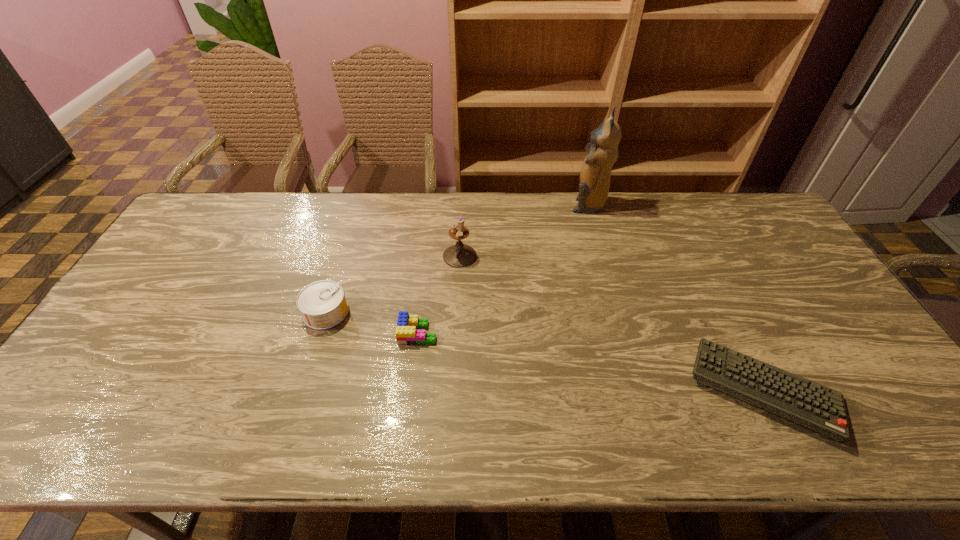
Locate an element on the screen. The image size is (960, 540). free space at the left edge of the desktop is located at coordinates (167, 272).

This screenshot has width=960, height=540. Find the location of `free region at the right edge of the desktop`. free region at the right edge of the desktop is located at coordinates (817, 318).

The height and width of the screenshot is (540, 960). In the image, there is a desktop. In order to click on vacant space at the far left corner in this screenshot , I will do 184,235.

Where is `empty space between the second tallest object and the Lego`? Image resolution: width=960 pixels, height=540 pixels. empty space between the second tallest object and the Lego is located at coordinates (439, 294).

You are a GUI agent. You are given a task and a screenshot of the screen. Output one action in this format:
    pyautogui.click(x=<x>, y=<y>)
    Task: Click on the free area in between the third tallest object and the Lego
    This screenshot has width=960, height=540.
    Given the screenshot: What is the action you would take?
    pyautogui.click(x=372, y=322)

The width and height of the screenshot is (960, 540). I want to click on free space between the fourth shortest object and the leftmost object, so click(393, 284).

Where is `vacant area between the Lego and the rightmost object`? Image resolution: width=960 pixels, height=540 pixels. vacant area between the Lego and the rightmost object is located at coordinates (590, 361).

Find the location of a particular element. The height and width of the screenshot is (540, 960). vacant area that lies between the farthest object and the rightmost object is located at coordinates (675, 297).

Where is `blank region between the farthest object and the fourth shortest object`? This screenshot has height=540, width=960. blank region between the farthest object and the fourth shortest object is located at coordinates (524, 230).

The height and width of the screenshot is (540, 960). Find the location of `free space between the tallest object and the Lego`. free space between the tallest object and the Lego is located at coordinates [503, 269].